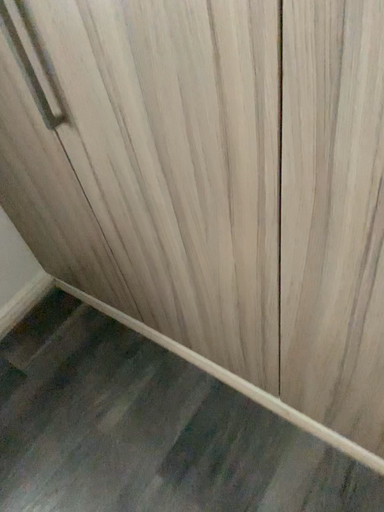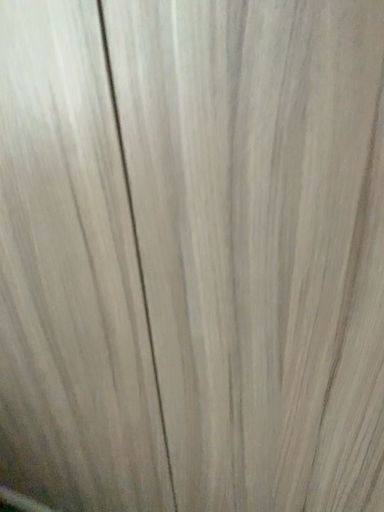
Question: How did the camera likely rotate when shooting the video?

Choices:
 (A) rotated upward
 (B) rotated downward

Answer: (A)